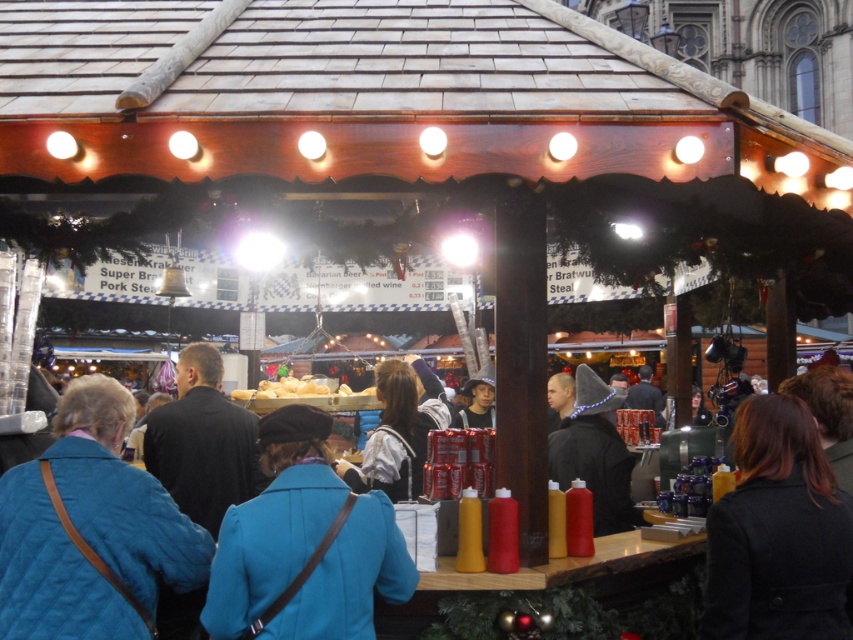
Can you confirm if blue quilted coat at center is positioned to the left of dark brown leather coat at lower right?

Yes, blue quilted coat at center is to the left of dark brown leather coat at lower right.

Which is behind, point (381, 593) or point (790, 529)?

The point (381, 593) is behind.

Is point (236, 529) closer to viewer compared to point (825, 460)?

Yes, point (236, 529) is in front of point (825, 460).

Locate an element on the screen. Image resolution: width=853 pixels, height=640 pixels. blue quilted coat at center is located at coordinates (305, 545).

Does quilted blue jacket at lower left come behind blue quilted coat at center?

That is False.

What do you see at coordinates (91, 529) in the screenshot? This screenshot has height=640, width=853. I see `quilted blue jacket at lower left` at bounding box center [91, 529].

Where is `quilted blue jacket at lower left`? This screenshot has width=853, height=640. quilted blue jacket at lower left is located at coordinates 91,529.

In the scene shown: Does quilted blue jacket at lower left have a lesser height compared to black woolen hat at center?

In fact, quilted blue jacket at lower left may be taller than black woolen hat at center.

Between quilted blue jacket at lower left and black woolen hat at center, which one appears on the left side from the viewer's perspective?

quilted blue jacket at lower left

Is point (27, 595) positioned before point (581, 435)?

Yes.

Where is `quilted blue jacket at lower left`? The width and height of the screenshot is (853, 640). quilted blue jacket at lower left is located at coordinates (91, 529).